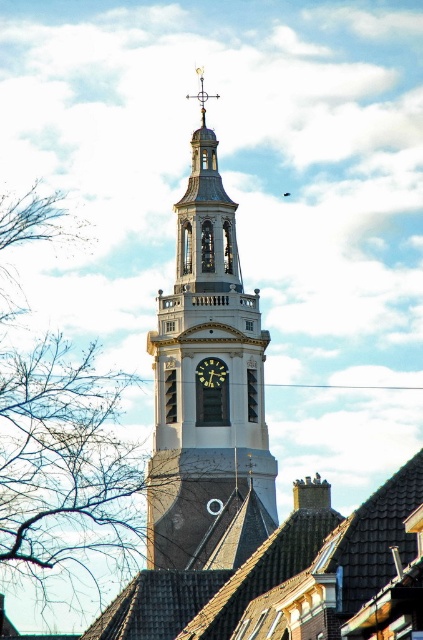
Question: Does polished brass clock tower at center come in front of bare branches at left?

Choices:
 (A) yes
 (B) no

Answer: (A)

Question: Which point is closer to the camera taking this photo?

Choices:
 (A) (233, 323)
 (B) (211, 372)
 (C) (19, 438)

Answer: (B)

Question: Which of the following is the closest to the observer?

Choices:
 (A) (200, 298)
 (B) (24, 381)
 (C) (211, 380)

Answer: (C)

Question: Is polished brass clock tower at center thinner than bare branches at left?

Choices:
 (A) no
 (B) yes

Answer: (B)

Question: Does polished brass clock tower at center appear on the right side of bare branches at left?

Choices:
 (A) yes
 (B) no

Answer: (A)

Question: Which point is farther to the camera?

Choices:
 (A) bare branches at left
 (B) polished brass clock tower at center
 (C) matte black clock at center

Answer: (C)